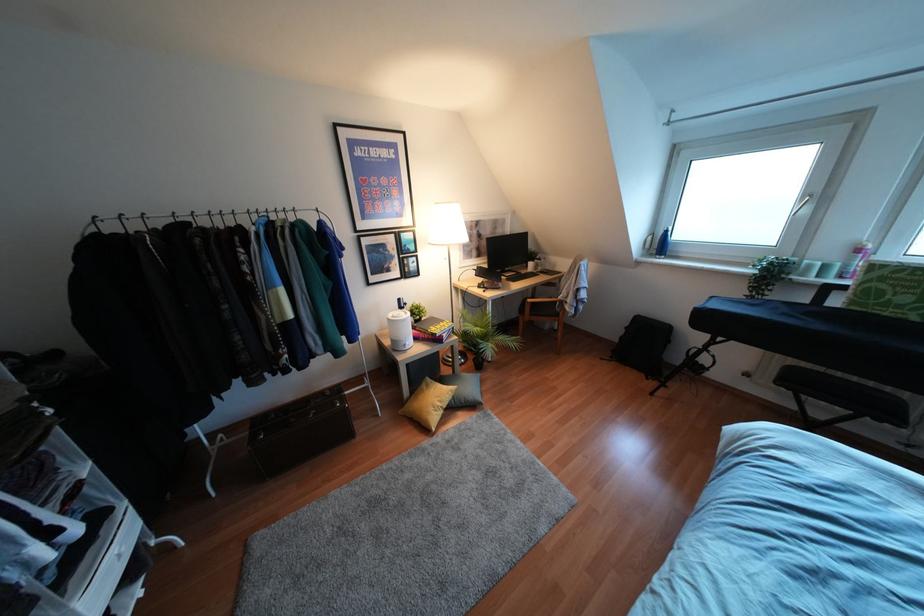
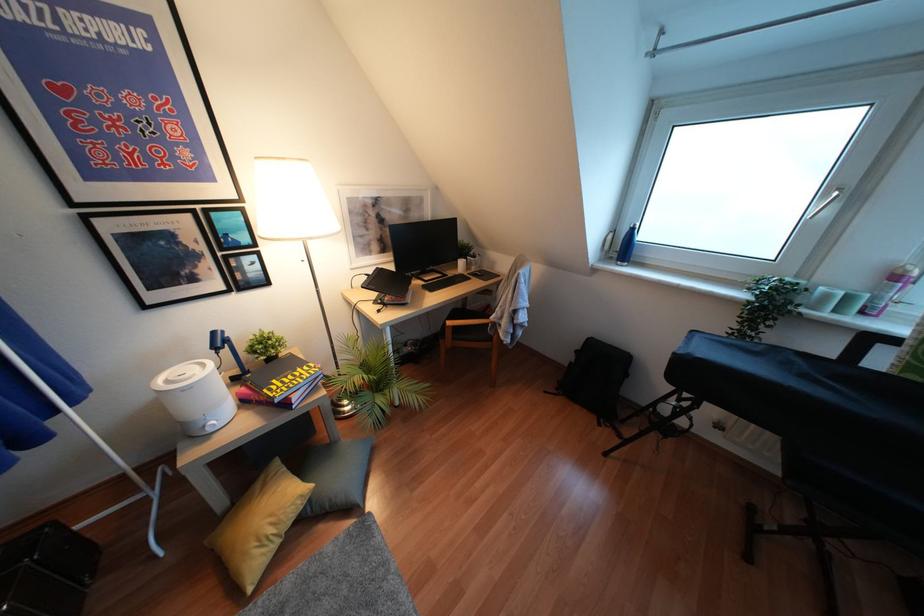
The point at (x=660, y=245) is marked in the first image. Where is the corresponding point in the second image?

(623, 246)